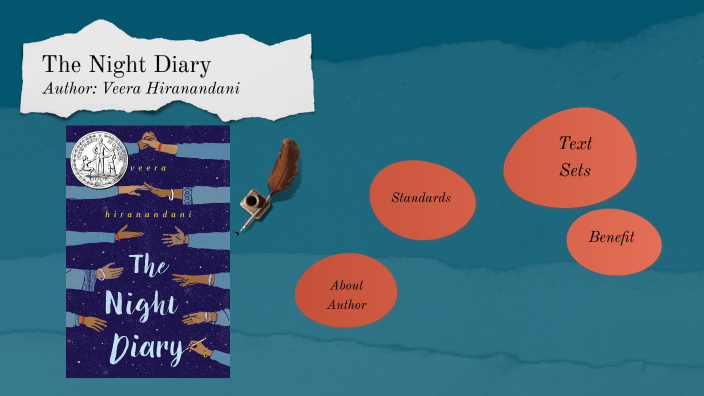
This screenshot has width=704, height=396. Identify the location of award. (99, 154).